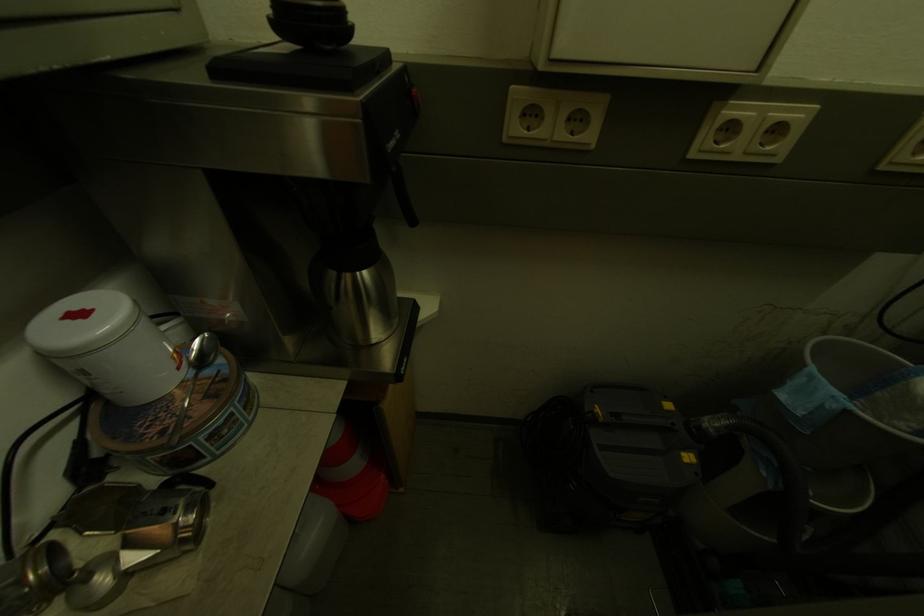
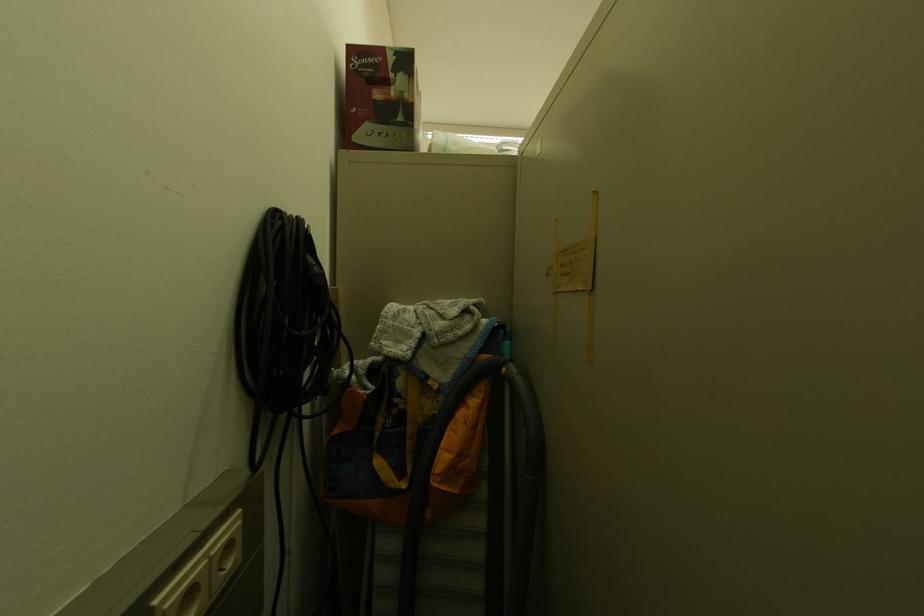
Question: The camera is either moving clockwise (left) or counter-clockwise (right) around the object. The first image is from the beginning of the video and the second image is from the end. Is the camera moving left or right when shooting the video?

Choices:
 (A) Left
 (B) Right

Answer: (A)